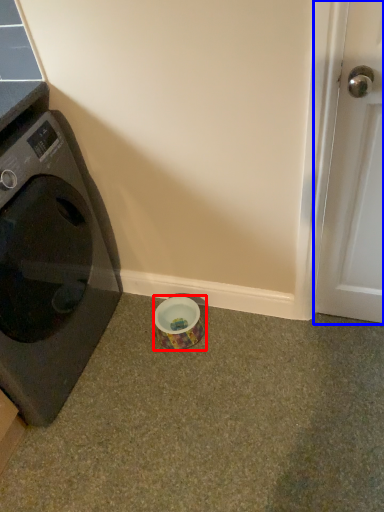
Question: Which point is closer to the camera, tape (highlighted by a red box) or door (highlighted by a blue box)?

Choices:
 (A) tape
 (B) door

Answer: (B)